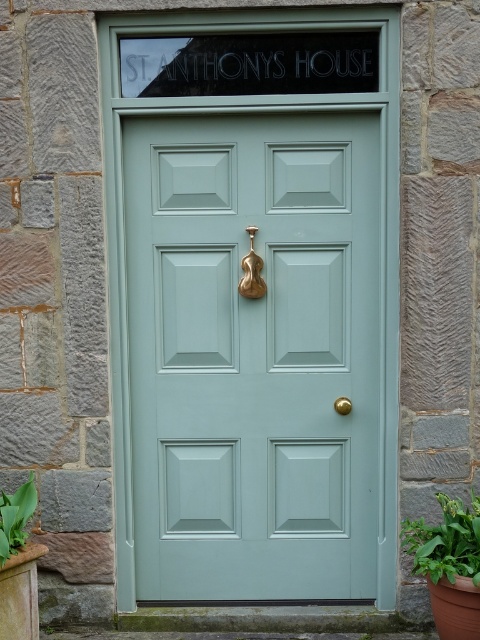
Question: Does satin teal door at center appear on the right side of green leafy plant at lower left?

Choices:
 (A) no
 (B) yes

Answer: (B)

Question: Which of these objects is positioned farthest from the green leafy plant at lower left?

Choices:
 (A) gold polished violin-shaped handle at center
 (B) green leafy plant at lower right
 (C) gold metallic door handle at center

Answer: (B)

Question: Which point is closer to the camera?

Choices:
 (A) satin teal door at center
 (B) green leafy plant at lower right
 (C) gold metallic door handle at center
 (D) green leafy plant at lower left

Answer: (D)

Question: Can you confirm if satin teal door at center is positioned to the right of green leafy plant at lower right?

Choices:
 (A) yes
 (B) no

Answer: (B)

Question: Can you confirm if green leafy plant at lower right is thinner than green leafy plant at lower left?

Choices:
 (A) no
 (B) yes

Answer: (A)

Question: Which point is farther to the camera?

Choices:
 (A) gold metallic door handle at center
 (B) gold polished violin-shaped handle at center

Answer: (A)